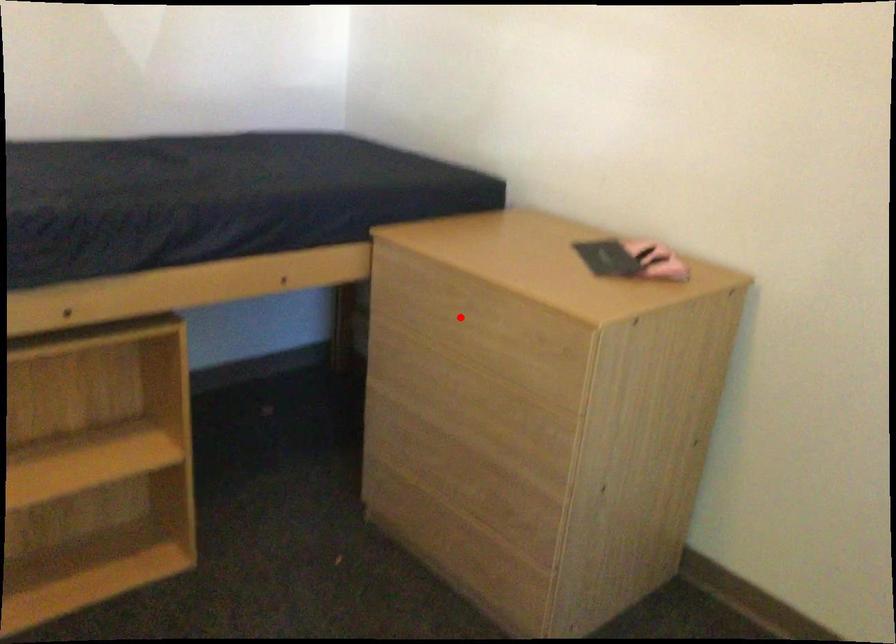
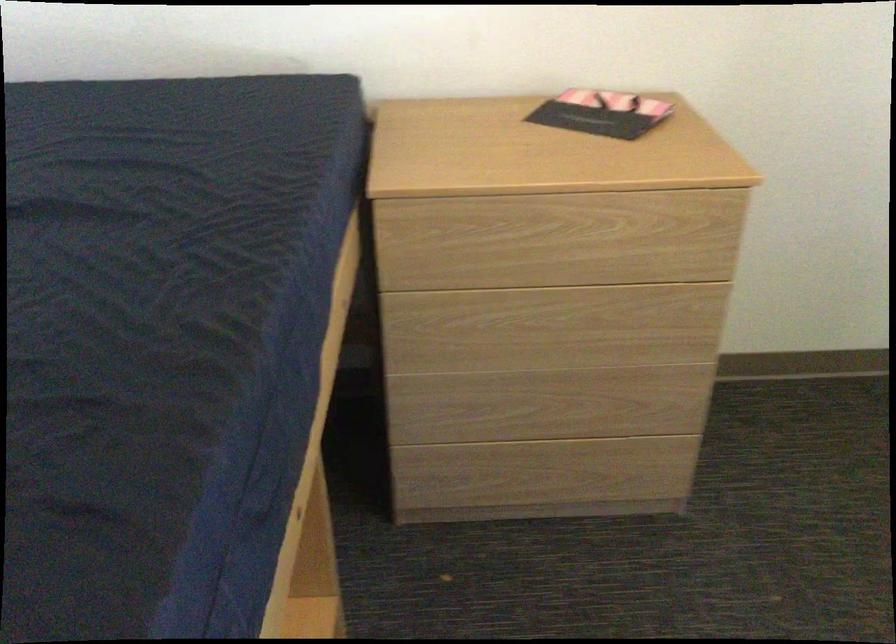
The point at the highlighted location is marked in the first image. Where is the corresponding point in the second image?

(557, 240)